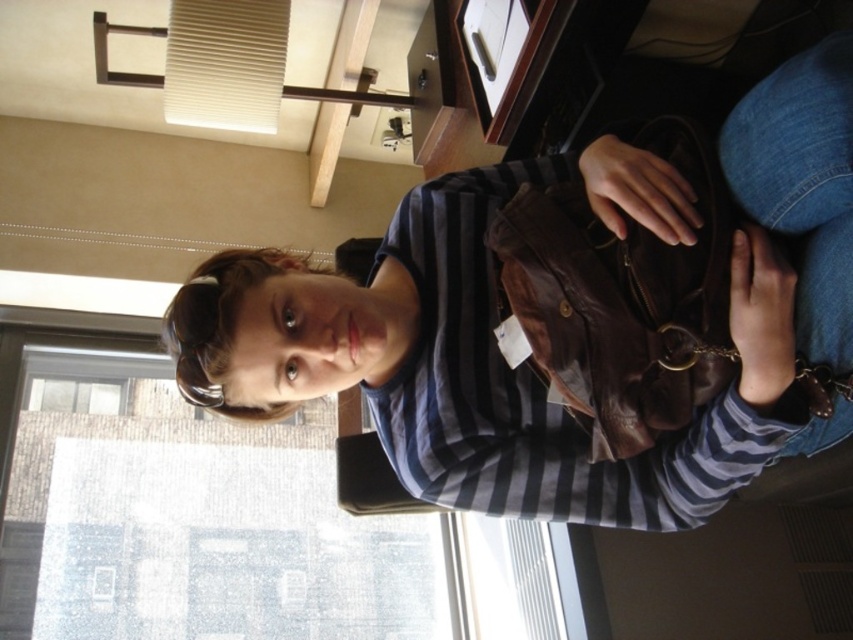
Question: Is matte brown purse at center positioned in front of transparent glass window at upper left?

Choices:
 (A) yes
 (B) no

Answer: (A)

Question: Which point appears closest to the camera in this image?

Choices:
 (A) (450, 385)
 (B) (235, 464)

Answer: (A)

Question: Is matte brown purse at center wider than transparent glass window at upper left?

Choices:
 (A) yes
 (B) no

Answer: (B)

Question: Does matte brown purse at center appear on the left side of transparent glass window at upper left?

Choices:
 (A) yes
 (B) no

Answer: (B)